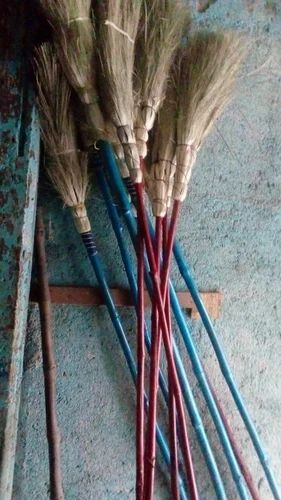
Find the location of a particular element. Image resolution: width=281 pixels, height=500 pixels. broom is located at coordinates pyautogui.click(x=79, y=179).